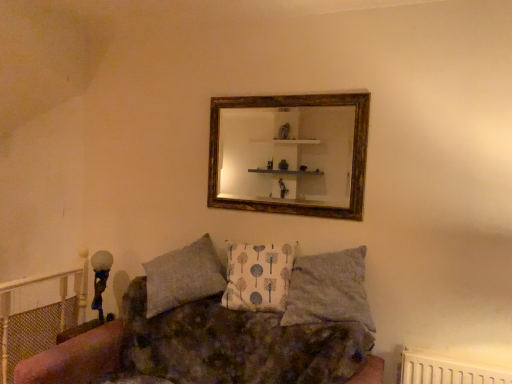
Question: Is gold-framed mirror at upper center at the back of textured fabric couch at center?

Choices:
 (A) no
 (B) yes

Answer: (A)

Question: Does textured fabric couch at center lie behind gold-framed mirror at upper center?

Choices:
 (A) no
 (B) yes

Answer: (A)

Question: Is textured fabric couch at center beside gold-framed mirror at upper center?

Choices:
 (A) yes
 (B) no

Answer: (B)

Question: Is textured fabric couch at center at the right side of gold-framed mirror at upper center?

Choices:
 (A) no
 (B) yes

Answer: (A)

Question: Does textured fabric couch at center come in front of gold-framed mirror at upper center?

Choices:
 (A) yes
 (B) no

Answer: (A)

Question: Considering the relative sizes of textured fabric couch at center and gold-framed mirror at upper center in the image provided, is textured fabric couch at center taller than gold-framed mirror at upper center?

Choices:
 (A) yes
 (B) no

Answer: (A)

Question: From a real-world perspective, is textured fabric couch at center on gray fabric pillow at center, which is the 1th pillow in right-to-left order?

Choices:
 (A) no
 (B) yes

Answer: (A)

Question: From the image's perspective, does textured fabric couch at center appear higher than gray fabric pillow at center, the second pillow in the left-to-right sequence?

Choices:
 (A) no
 (B) yes

Answer: (A)

Question: Is textured fabric couch at center smaller than gray fabric pillow at center, the second pillow in the left-to-right sequence?

Choices:
 (A) yes
 (B) no

Answer: (B)

Question: Is textured fabric couch at center positioned with its back to gray fabric pillow at center, which is the 1th pillow in right-to-left order?

Choices:
 (A) no
 (B) yes

Answer: (A)

Question: Considering the relative sizes of textured fabric couch at center and gray fabric pillow at center, the second pillow in the left-to-right sequence, in the image provided, is textured fabric couch at center thinner than gray fabric pillow at center, the second pillow in the left-to-right sequence,?

Choices:
 (A) yes
 (B) no

Answer: (B)

Question: From a real-world perspective, is textured fabric couch at center beneath gray fabric pillow at center, which is the 1th pillow in right-to-left order?

Choices:
 (A) yes
 (B) no

Answer: (A)

Question: Considering the relative sizes of white fabric pillow at center, the second pillow positioned from the right, and textured fabric couch at center in the image provided, is white fabric pillow at center, the second pillow positioned from the right, shorter than textured fabric couch at center?

Choices:
 (A) no
 (B) yes

Answer: (B)